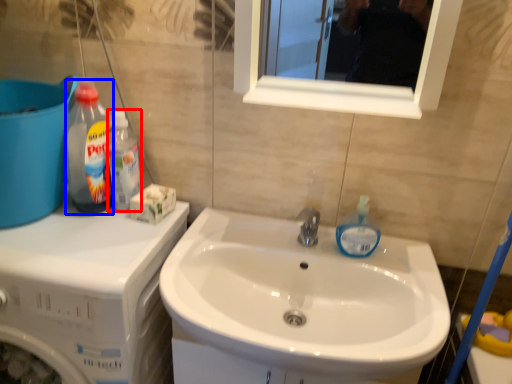
Question: Which of the following is the farthest to the observer, cleaning product (highlighted by a red box) or cleaning product (highlighted by a blue box)?

Choices:
 (A) cleaning product
 (B) cleaning product

Answer: (A)